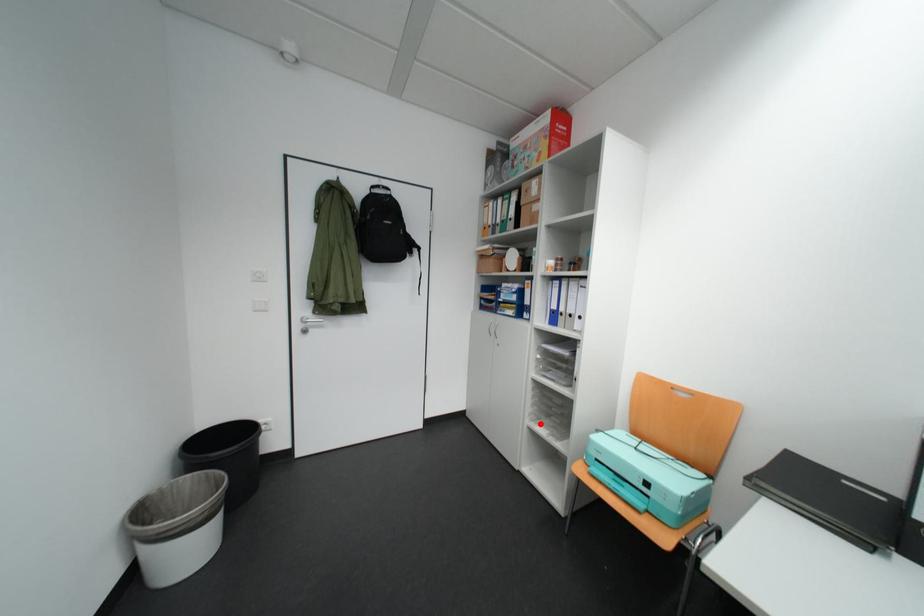
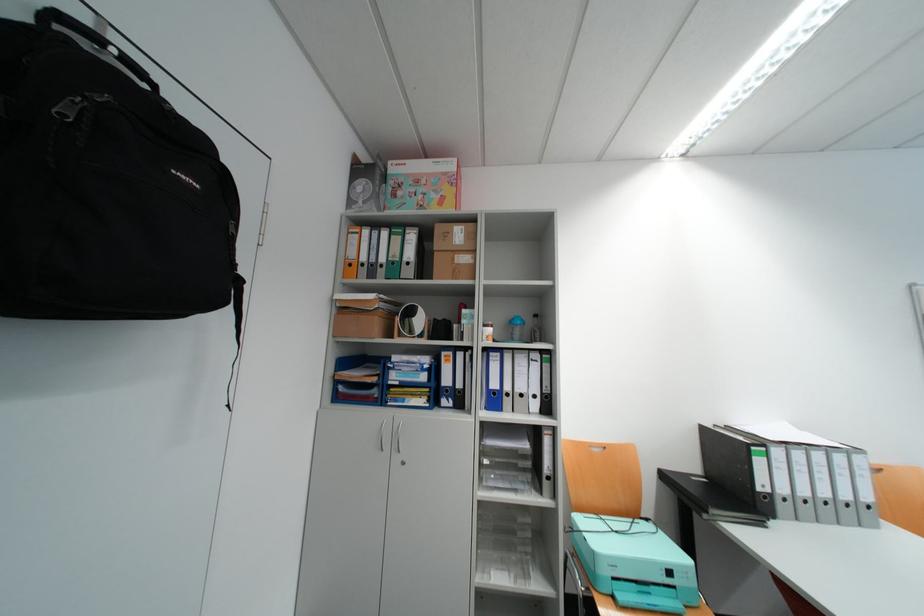
Question: A red point is marked in image1. In image2, is the corresponding 3D point closer to the camera or farther? Reply with the corresponding letter.

Choices:
 (A) The corresponding 3D point is closer.
 (B) The corresponding 3D point is farther.

Answer: (A)